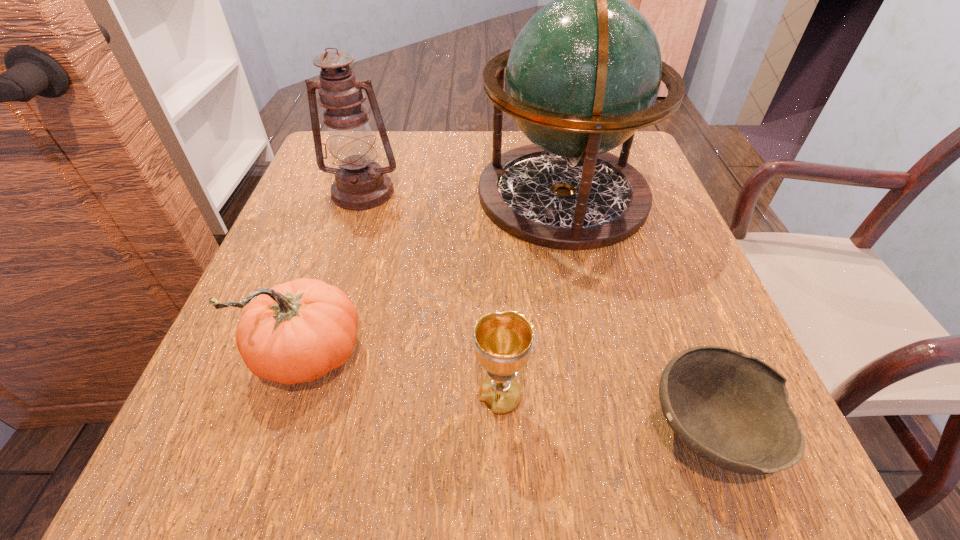
Find the location of a particular element. The image size is (960, 540). vacant region located on the left of the second shortest object is located at coordinates (394, 396).

At what (x,y) coordinates should I click in order to perform the action: click on vacant space positioned on the back of the bowl. Please return your answer as a coordinate pair (x, y). Image resolution: width=960 pixels, height=540 pixels. Looking at the image, I should click on (650, 272).

At what (x,y) coordinates should I click in order to perform the action: click on globe located at the far edge. Please return your answer as a coordinate pair (x, y). Looking at the image, I should click on (582, 76).

Locate an element on the screen. The height and width of the screenshot is (540, 960). oil lamp present at the far edge is located at coordinates (360, 183).

Identify the location of object located in the near edge section of the desktop. Image resolution: width=960 pixels, height=540 pixels. (731, 409).

Find the location of a particular element. oil lamp positioned at the left edge is located at coordinates (360, 183).

At what (x,y) coordinates should I click in order to perform the action: click on pumpkin that is at the left edge. Please return your answer as a coordinate pair (x, y). The width and height of the screenshot is (960, 540). Looking at the image, I should click on (294, 332).

You are a GUI agent. You are given a task and a screenshot of the screen. Output one action in this format:
    pyautogui.click(x=<x>, y=<y>)
    Task: Click on the globe at the right edge
    The width and height of the screenshot is (960, 540).
    Given the screenshot: What is the action you would take?
    pyautogui.click(x=582, y=76)

Where is `bowl present at the right edge`? The height and width of the screenshot is (540, 960). bowl present at the right edge is located at coordinates (731, 409).

In order to click on object located at the far left corner in this screenshot , I will do `click(360, 183)`.